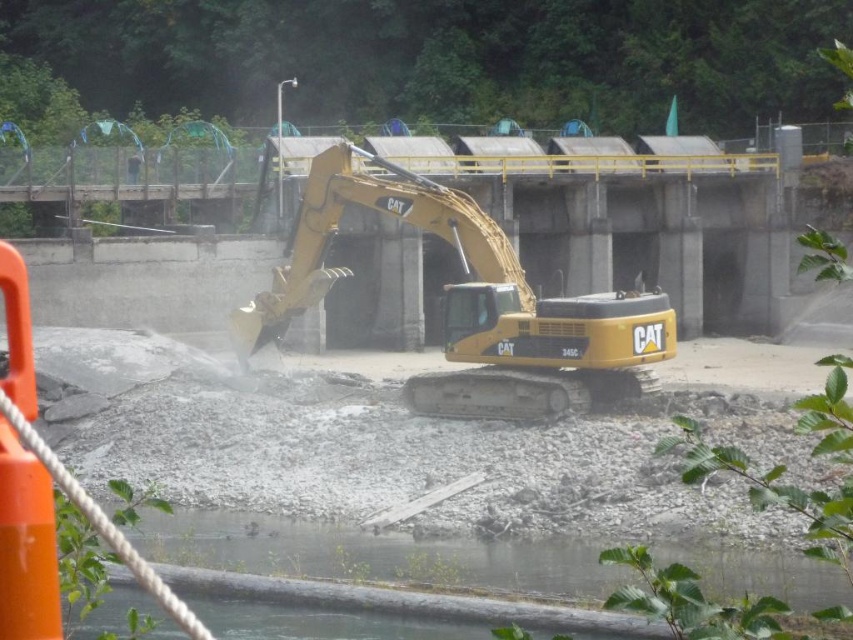
Question: Can you confirm if gray gravel at center is positioned below clear water at lower center?

Choices:
 (A) yes
 (B) no

Answer: (B)

Question: Which of the following is the closest to the observer?

Choices:
 (A) (248, 419)
 (B) (624, 396)
 (C) (799, 605)

Answer: (C)

Question: Is gray gravel at center bigger than clear water at lower center?

Choices:
 (A) yes
 (B) no

Answer: (A)

Question: Can you confirm if gray gravel at center is thinner than yellow metallic excavator at center?

Choices:
 (A) no
 (B) yes

Answer: (A)

Question: Which is farther from the gray gravel at center?

Choices:
 (A) yellow metallic excavator at center
 (B) clear water at lower center

Answer: (A)

Question: Which point is farther to the camera?

Choices:
 (A) [x=268, y=403]
 (B) [x=744, y=561]
 (C) [x=543, y=362]

Answer: (A)